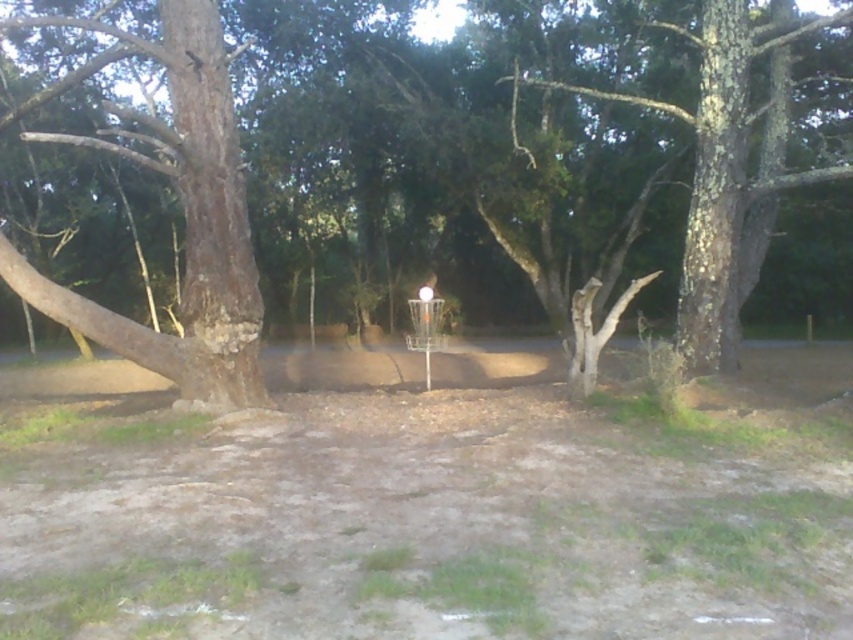
Is brown rough tree at center positioned before rough bark tree at center?

No, it is not.

Which is more to the right, brown rough tree at center or rough bark tree at center?

brown rough tree at center

Is point (181, 340) less distant than point (734, 266)?

Yes, point (181, 340) is closer to viewer.

Image resolution: width=853 pixels, height=640 pixels. What are the coordinates of `brown rough tree at center` in the screenshot? It's located at (184, 218).

Does rough bark tree at left have a smaller size compared to rough bark tree at center?

Incorrect, rough bark tree at left is not smaller in size than rough bark tree at center.

Between rough bark tree at left and rough bark tree at center, which one is positioned lower?

rough bark tree at left is lower down.

Between point (196, 70) and point (740, 132), which one is positioned in front?

Point (196, 70) is in front.

You are a GUI agent. You are given a task and a screenshot of the screen. Output one action in this format:
    pyautogui.click(x=<x>, y=<y>)
    Task: Click on the rough bark tree at left
    
    Given the screenshot: What is the action you would take?
    pyautogui.click(x=184, y=220)

Does brown rough tree at center have a lesser height compared to rough bark tree at left?

Correct, brown rough tree at center is not as tall as rough bark tree at left.

Which is below, brown rough tree at center or rough bark tree at left?

brown rough tree at center is below.

Is point (708, 336) behind point (180, 188)?

Yes.

The image size is (853, 640). I want to click on brown rough tree at center, so click(x=184, y=218).